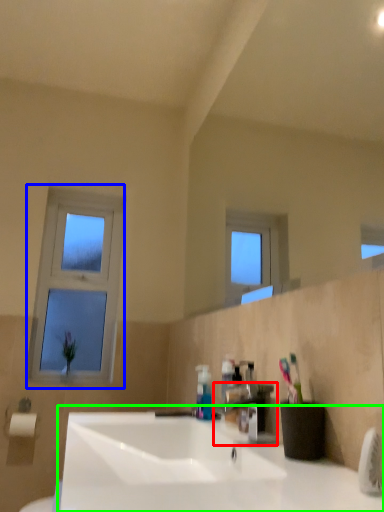
Question: Estimate the real-world distances between objects in this image. Which object is farther from tap (highlighted by a red box), window (highlighted by a blue box) or sink (highlighted by a green box)?

Choices:
 (A) window
 (B) sink

Answer: (A)